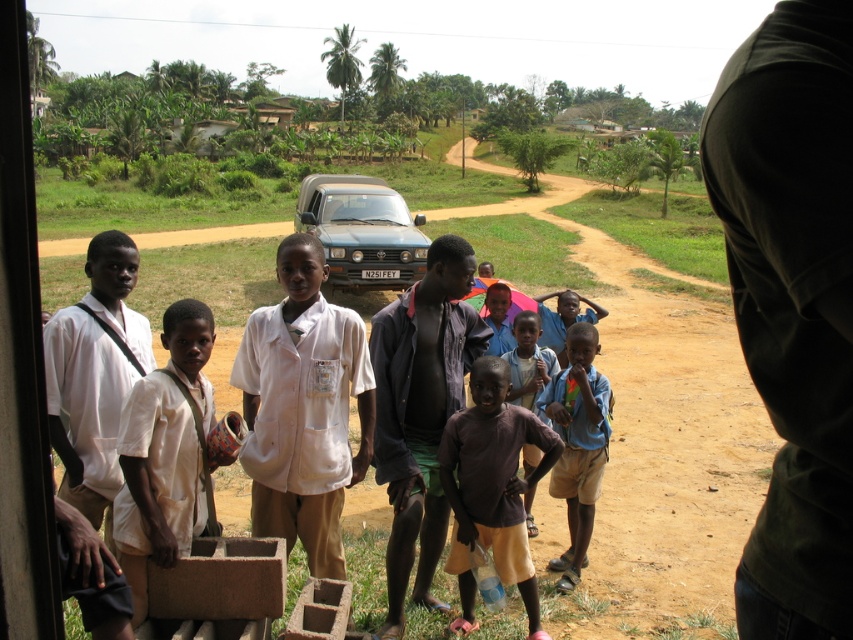
Question: Considering the relative positions of white cotton shirt at center and blue metallic car at center in the image provided, where is white cotton shirt at center located with respect to blue metallic car at center?

Choices:
 (A) above
 (B) below

Answer: (B)

Question: Does dark brown fabric shirt at center lie in front of white matte shirt at left?

Choices:
 (A) no
 (B) yes

Answer: (A)

Question: Considering the real-world distances, which object is farthest from the blue metallic car at center?

Choices:
 (A) brown matte shirt at center
 (B) light brown skin at center
 (C) white matte shirt at center

Answer: (C)

Question: Among these objects, which one is farthest from the camera?

Choices:
 (A) light brown skin at center
 (B) dark green shirt at right

Answer: (A)

Question: Which of the following is the closest to the observer?

Choices:
 (A) (54, 328)
 (B) (440, 451)
 (C) (576, 557)

Answer: (A)

Question: Does white matte shirt at left appear under brown matte shirt at center?

Choices:
 (A) yes
 (B) no

Answer: (B)